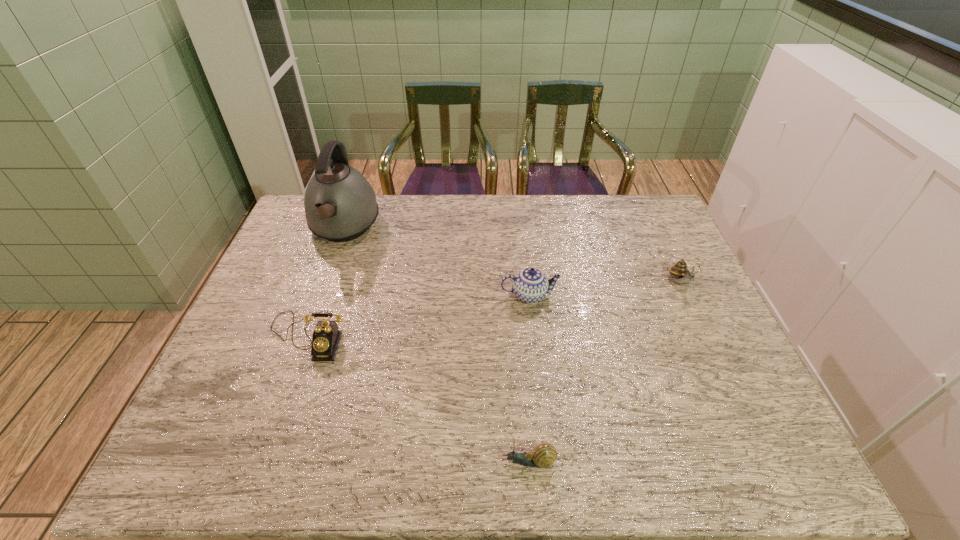
Find the location of `free point between the shorter escargot and the chinaware`. free point between the shorter escargot and the chinaware is located at coordinates (529, 379).

This screenshot has height=540, width=960. In order to click on blank region between the left escargot and the farthest object in this screenshot , I will do `click(437, 345)`.

You are a GUI agent. You are given a task and a screenshot of the screen. Output one action in this format:
    pyautogui.click(x=<x>, y=<y>)
    Task: Click on the free space between the chinaware and the taller escargot
    This screenshot has width=960, height=540.
    Given the screenshot: What is the action you would take?
    pyautogui.click(x=605, y=289)

You are a GUI agent. You are given a task and a screenshot of the screen. Output one action in this format:
    pyautogui.click(x=<x>, y=<y>)
    Task: Click on the blank region between the tallest object and the nearest object
    The image size is (960, 540).
    Given the screenshot: What is the action you would take?
    pyautogui.click(x=437, y=345)

Find the location of a particular element. unoccupied area between the farther escargot and the kettle is located at coordinates (512, 255).

This screenshot has height=540, width=960. I want to click on free space that is in between the farthest object and the shortest object, so click(437, 345).

I want to click on object identified as the closest to the tallest object, so click(326, 337).

This screenshot has width=960, height=540. What are the coordinates of `object that is the second closest to the shorter escargot` in the screenshot? It's located at (326, 337).

Where is `blank area in the image that satisfies the following two spatial constraints: 1. on the face of the rightmost object; 2. on the front-facing side of the shortest object`? This screenshot has width=960, height=540. blank area in the image that satisfies the following two spatial constraints: 1. on the face of the rightmost object; 2. on the front-facing side of the shortest object is located at coordinates (763, 462).